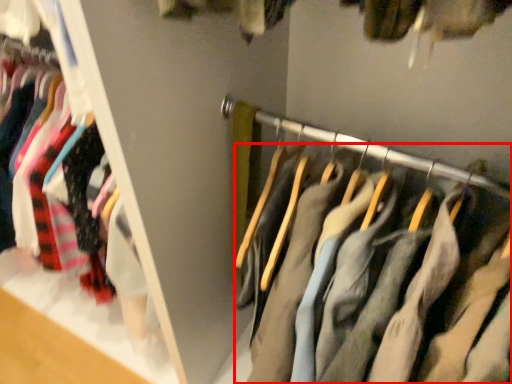
Question: From the image, what is the correct spatial relationship of trousers (annotated by the red box) in relation to closet?

Choices:
 (A) right
 (B) left

Answer: (A)